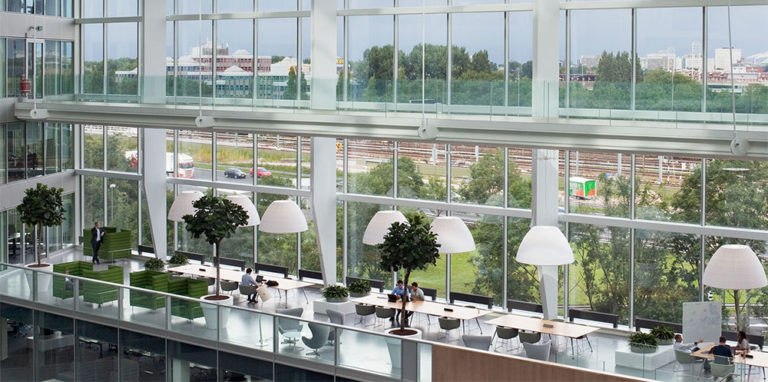
Where is `short glass`? This screenshot has height=382, width=768. short glass is located at coordinates (431, 366), (362, 357), (316, 340), (252, 328), (190, 314), (133, 311), (90, 302), (50, 292), (5, 281).